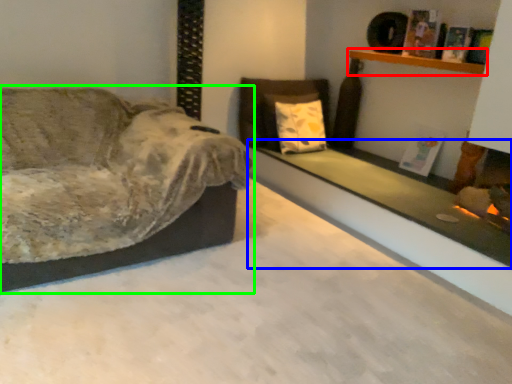
Question: Estimate the real-world distances between objects in this image. Which object is farther from shelf (highlighted by a red box), ledge (highlighted by a blue box) or studio couch (highlighted by a green box)?

Choices:
 (A) ledge
 (B) studio couch

Answer: (B)